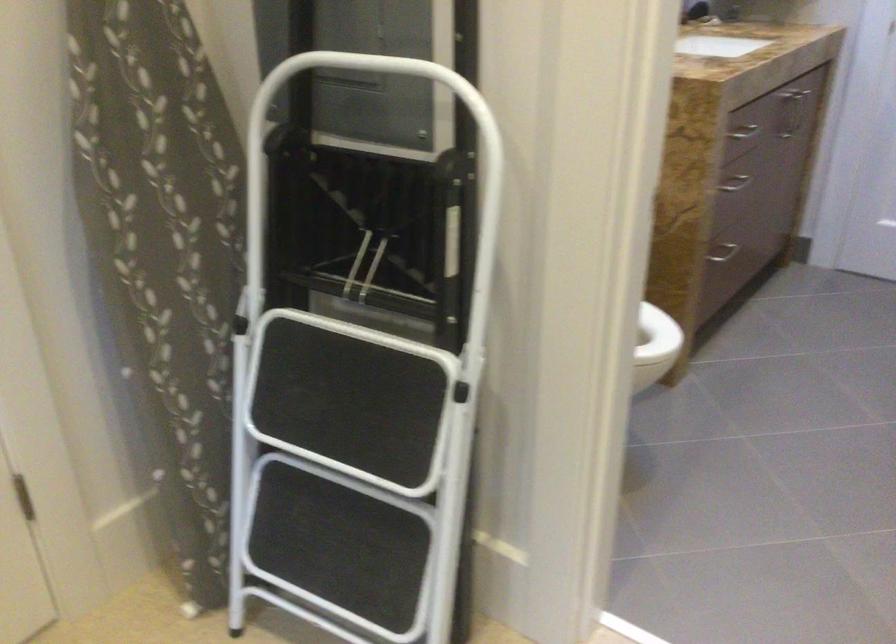
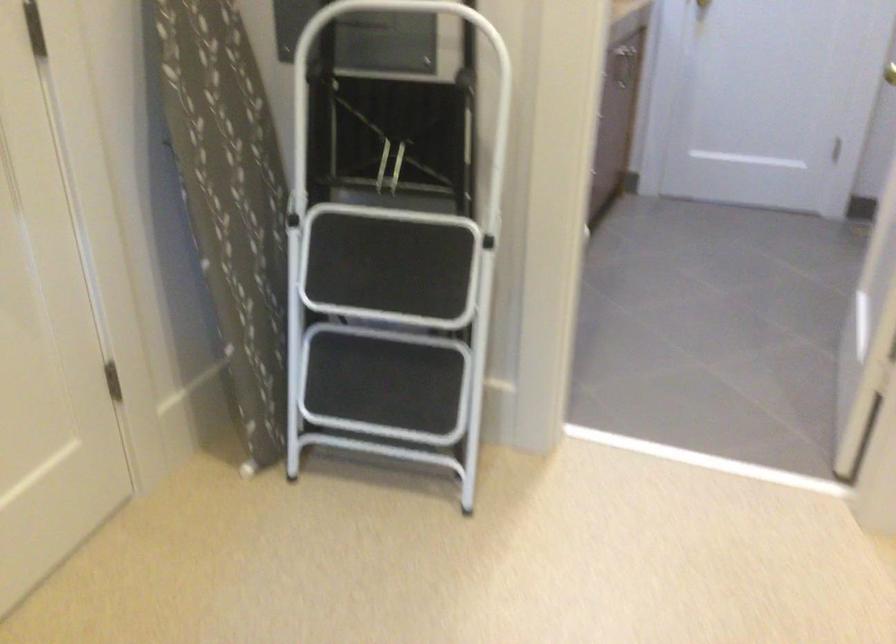
In the second image, find the point that corresponds to [177,292] in the first image.

(229, 199)